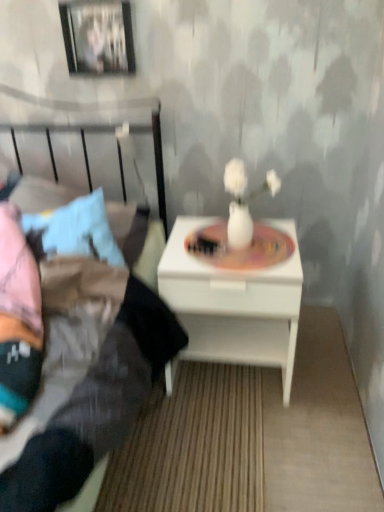
Question: Is white glossy nightstand at center oriented towards matte black bed at left?

Choices:
 (A) no
 (B) yes

Answer: (A)

Question: Is white glossy nightstand at center smaller than matte black bed at left?

Choices:
 (A) yes
 (B) no

Answer: (A)

Question: Considering the relative sizes of white glossy nightstand at center and matte black bed at left in the image provided, is white glossy nightstand at center wider than matte black bed at left?

Choices:
 (A) no
 (B) yes

Answer: (A)

Question: Does white glossy nightstand at center contain matte black bed at left?

Choices:
 (A) yes
 (B) no

Answer: (B)

Question: Is white glossy nightstand at center positioned before matte black bed at left?

Choices:
 (A) no
 (B) yes

Answer: (A)

Question: Would you say white glossy nightstand at center is a long distance from matte black bed at left?

Choices:
 (A) yes
 (B) no

Answer: (B)

Question: Considering the relative sizes of matte white vase at center and white glossy nightstand at center in the image provided, is matte white vase at center taller than white glossy nightstand at center?

Choices:
 (A) yes
 (B) no

Answer: (B)

Question: Is matte white vase at center turned away from white glossy nightstand at center?

Choices:
 (A) no
 (B) yes

Answer: (B)

Question: Is matte white vase at center oriented towards white glossy nightstand at center?

Choices:
 (A) yes
 (B) no

Answer: (A)

Question: Does matte white vase at center have a larger size compared to white glossy nightstand at center?

Choices:
 (A) no
 (B) yes

Answer: (A)

Question: Is matte white vase at center smaller than white glossy nightstand at center?

Choices:
 (A) yes
 (B) no

Answer: (A)

Question: Is matte white vase at center to the right of white glossy nightstand at center from the viewer's perspective?

Choices:
 (A) no
 (B) yes

Answer: (B)

Question: From a real-world perspective, is metallic silver picture frame at upper left positioned under white glossy nightstand at center based on gravity?

Choices:
 (A) yes
 (B) no

Answer: (B)